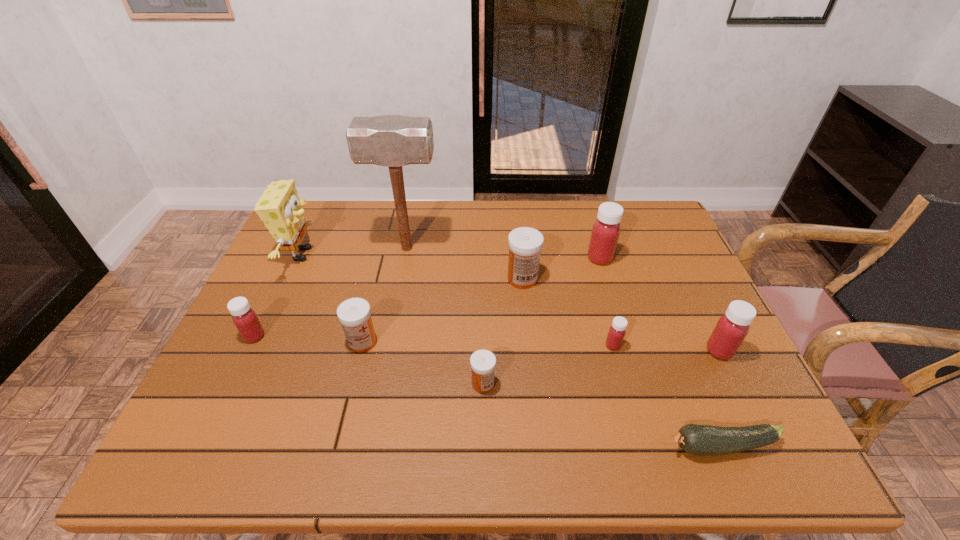
Point out which white medicine is positioned as the second nearest to the farthest medicine. Please provide its 2D coordinates. Your answer should be formatted as a tuple, i.e. [(x, y)], where the tuple contains the x and y coordinates of a point satisfying the conditions above.

[(483, 362)]

Where is `white medicine that is the closest to the second white medicine from right to left`? Image resolution: width=960 pixels, height=540 pixels. white medicine that is the closest to the second white medicine from right to left is located at coordinates (354, 314).

Find the location of a particular element. The height and width of the screenshot is (540, 960). free spot that satisfies the following two spatial constraints: 1. on the front side of the second biggest white medicine; 2. on the left side of the rightmost red medicine is located at coordinates (360, 351).

Where is `free space in the image that satisfies the following two spatial constraints: 1. on the striking face of the mallet; 2. on the left side of the nearest medicine`? free space in the image that satisfies the following two spatial constraints: 1. on the striking face of the mallet; 2. on the left side of the nearest medicine is located at coordinates (381, 384).

Locate an element on the screen. Image resolution: width=960 pixels, height=540 pixels. free spot that satisfies the following two spatial constraints: 1. on the front side of the biggest red medicine; 2. on the right side of the rightmost red medicine is located at coordinates (628, 351).

Locate an element on the screen. vacant space that satisfies the following two spatial constraints: 1. on the face of the yellow sponge; 2. on the left side of the rightmost medicine is located at coordinates (256, 351).

Identify the location of vacant point that satisfies the following two spatial constraints: 1. on the face of the yellow sponge; 2. on the back side of the smallest red medicine. The height and width of the screenshot is (540, 960). pos(259,346).